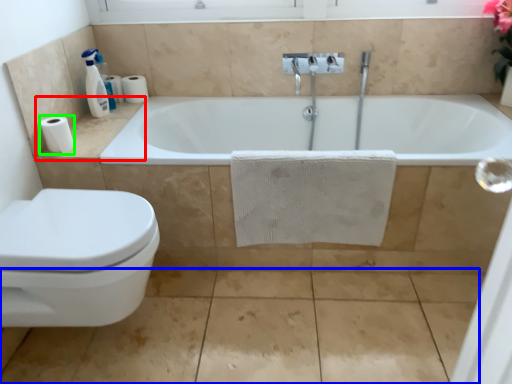
Question: Which object is the farthest from counter top (highlighted by a red box)? Choose among these: concrete (highlighted by a blue box) or toilet paper (highlighted by a green box).

Choices:
 (A) concrete
 (B) toilet paper

Answer: (A)